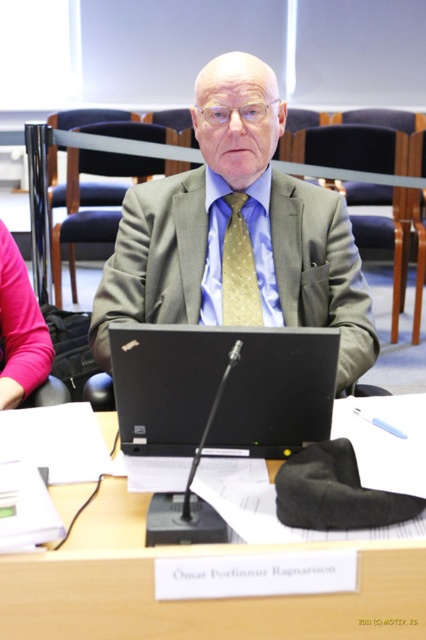
Question: Is wooden table at center further to the viewer compared to black matte laptop at center?

Choices:
 (A) no
 (B) yes

Answer: (A)

Question: Does black matte laptop at center appear on the left side of gold dotted fabric tie at center?

Choices:
 (A) no
 (B) yes

Answer: (B)

Question: Does gray textured suit at center appear on the left side of black matte laptop at center?

Choices:
 (A) no
 (B) yes

Answer: (A)

Question: Among these points, which one is farthest from the camera?

Choices:
 (A) (250, 314)
 (B) (357, 604)
 (C) (250, 387)

Answer: (A)

Question: Estimate the real-world distances between objects in this image. Which object is farther from the gold dotted fabric tie at center?

Choices:
 (A) black matte laptop at center
 (B) gray textured suit at center

Answer: (A)

Question: Which of these objects is positioned farthest from the gold dotted fabric tie at center?

Choices:
 (A) wooden table at center
 (B) gray textured suit at center
 (C) black matte laptop at center

Answer: (A)